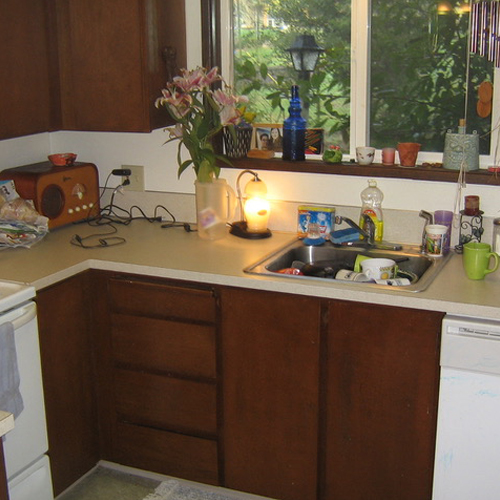
The image size is (500, 500). What are the coordinates of `kitchen counter` in the screenshot? It's located at click(234, 251).